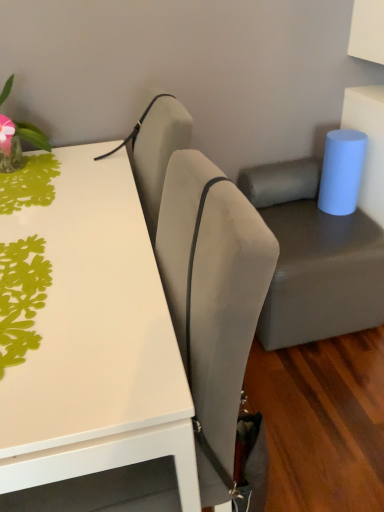
Locate an element on the screen. vacant space behind green paper cutout at upper left, the second plant from the top is located at coordinates (75, 209).